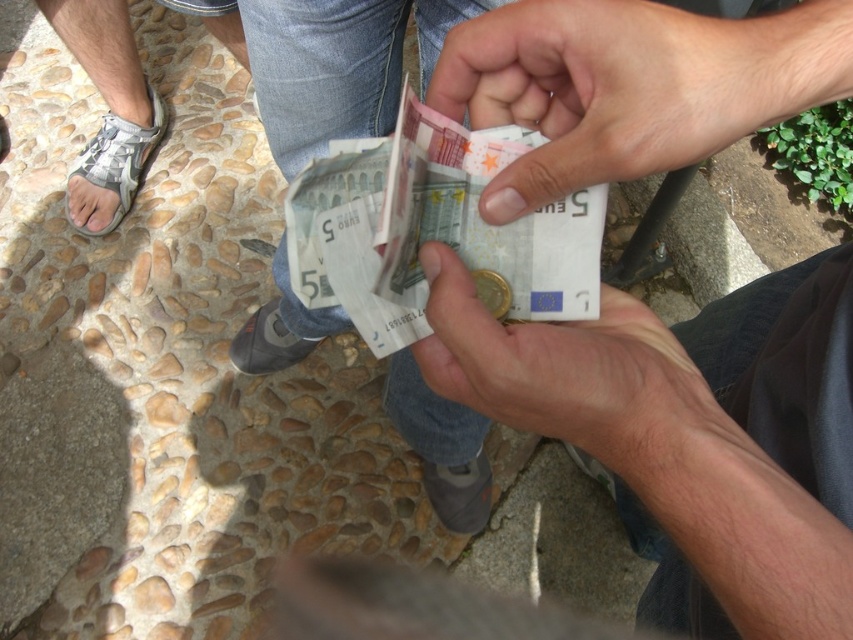
Question: Which point appears closest to the camera in this image?

Choices:
 (A) (91, 141)
 (B) (345, 141)
 (C) (656, 129)

Answer: (C)

Question: Considering the relative positions of matte skin hand at center and white woven sandal at left in the image provided, where is matte skin hand at center located with respect to white woven sandal at left?

Choices:
 (A) right
 (B) left

Answer: (A)

Question: Which of the following is the closest to the observer?

Choices:
 (A) (469, 365)
 (B) (99, 208)

Answer: (A)

Question: Which point is farther to the camera?

Choices:
 (A) matte skin hand at center
 (B) matte paper money at center

Answer: (A)

Question: Does white paper banknotes at center have a larger size compared to matte paper money at center?

Choices:
 (A) yes
 (B) no

Answer: (A)

Question: Can you confirm if matte paper money at center is positioned above white woven sandal at left?

Choices:
 (A) yes
 (B) no

Answer: (B)